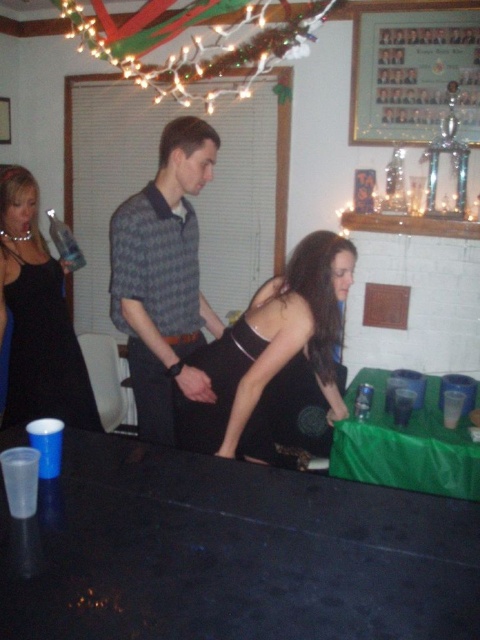
What are the coordinates of the gray checkered shirt at center?

The gray checkered shirt at center is located at coordinates point (x=164, y=276).

You are at a party and need to place both the metallic trophy at upper right and the transparent plastic cup at lower right on a shelf. The shelf has limited space and can only accommodate one of them. Based on their sizes, which item should you choose to fit on the shelf?

The metallic trophy at upper right is bigger than the transparent plastic cup at lower right, so the transparent plastic cup at lower right is smaller and would fit on the shelf.

You are at a party and need to place a 5 feet long ribbon between the metallic trophy at upper right and the transparent plastic cup at lower right. Can you fit the ribbon between them without bending it?

The metallic trophy at upper right and transparent plastic cup at lower right are 5.20 feet apart from each other, so yes, the ribbon can be placed between them without bending since it is slightly shorter than the distance between them.